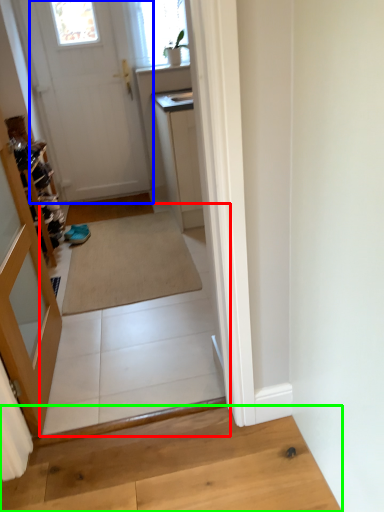
Question: Considering the real-world distances, which object is farthest from path (highlighted by a red box)? door (highlighted by a blue box) or hardwood (highlighted by a green box)?

Choices:
 (A) door
 (B) hardwood

Answer: (A)